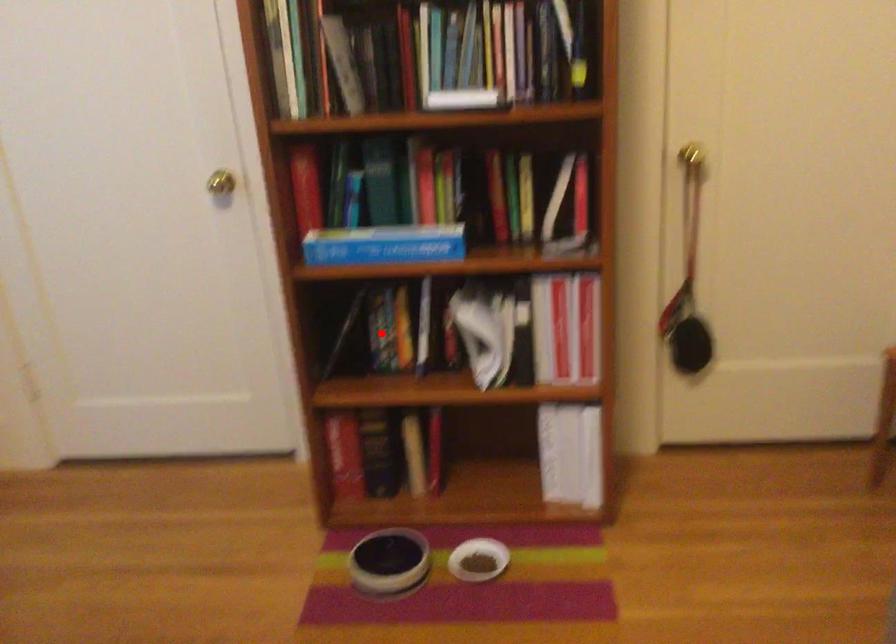
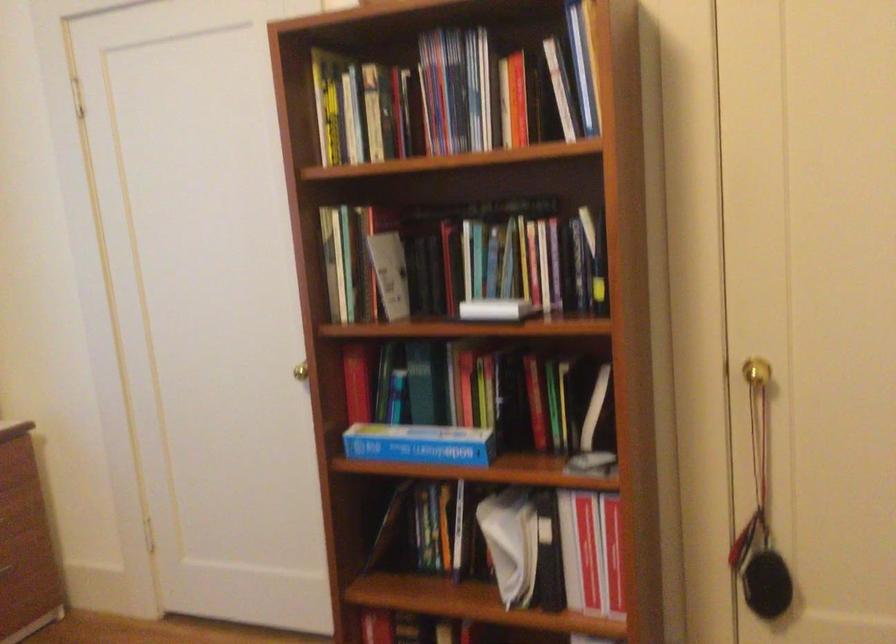
Find the pixel in the second image that matches the highlighted location in the first image.

(426, 527)